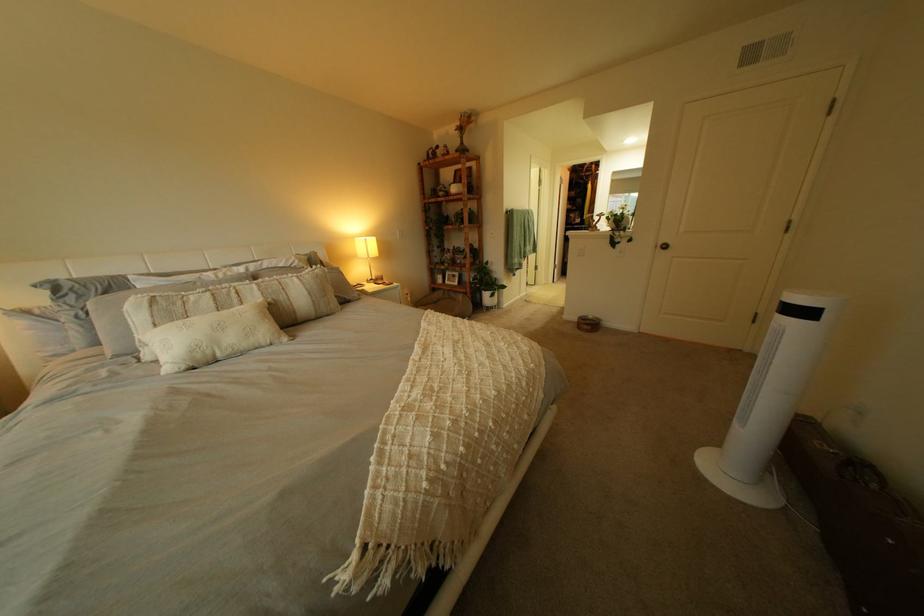
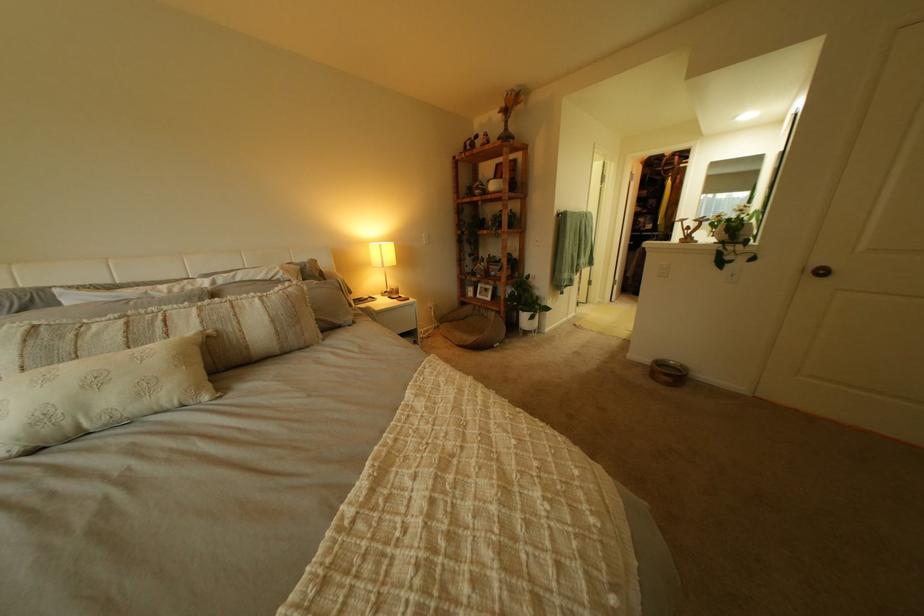
Find the pixel in the second image that matches (460,188) in the first image.

(497, 185)